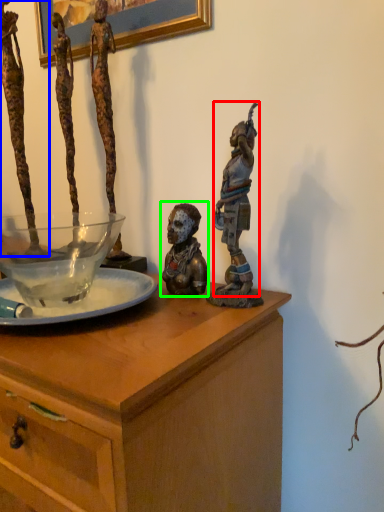
Question: Which is nearer to the person (highlighted by a red box)? person (highlighted by a blue box) or person (highlighted by a green box).

Choices:
 (A) person
 (B) person

Answer: (B)